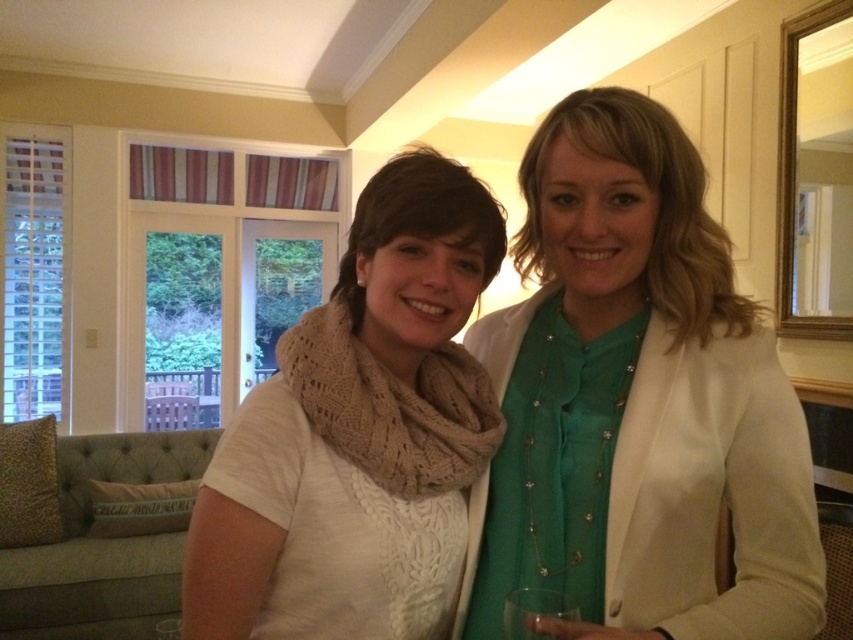
Does matte white blazer at center have a larger size compared to white knit scarf at center?

Yes, matte white blazer at center is bigger than white knit scarf at center.

Is matte white blazer at center to the left of white knit scarf at center from the viewer's perspective?

In fact, matte white blazer at center is to the right of white knit scarf at center.

Does point (677, 520) lie in front of point (213, 576)?

No, (677, 520) is further to viewer.

This screenshot has height=640, width=853. What are the coordinates of `matte white blazer at center` in the screenshot? It's located at (637, 401).

Based on the photo, between white knit scarf at center and knit beige scarf at center, which one is positioned lower?

white knit scarf at center

What do you see at coordinates (358, 433) in the screenshot? I see `white knit scarf at center` at bounding box center [358, 433].

This screenshot has width=853, height=640. I want to click on white knit scarf at center, so click(358, 433).

Is matte white blazer at center to the right of knit beige scarf at center from the viewer's perspective?

Indeed, matte white blazer at center is positioned on the right side of knit beige scarf at center.

Can you confirm if matte white blazer at center is positioned to the left of knit beige scarf at center?

Incorrect, matte white blazer at center is not on the left side of knit beige scarf at center.

Is point (585, 348) behind point (286, 378)?

Yes, it is.

At what (x,y) coordinates should I click in order to perform the action: click on matte white blazer at center. Please return your answer as a coordinate pair (x, y). Looking at the image, I should click on (637, 401).